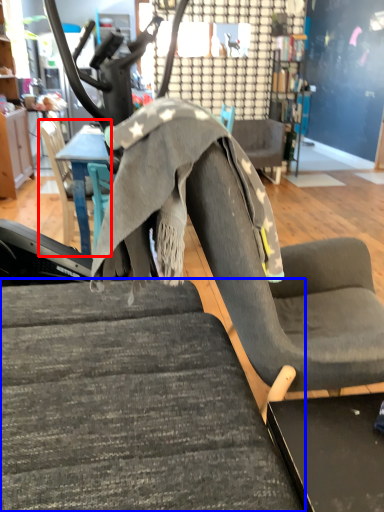
Question: Among these objects, which one is farthest to the camera, chair (highlighted by a red box) or chair (highlighted by a blue box)?

Choices:
 (A) chair
 (B) chair

Answer: (A)